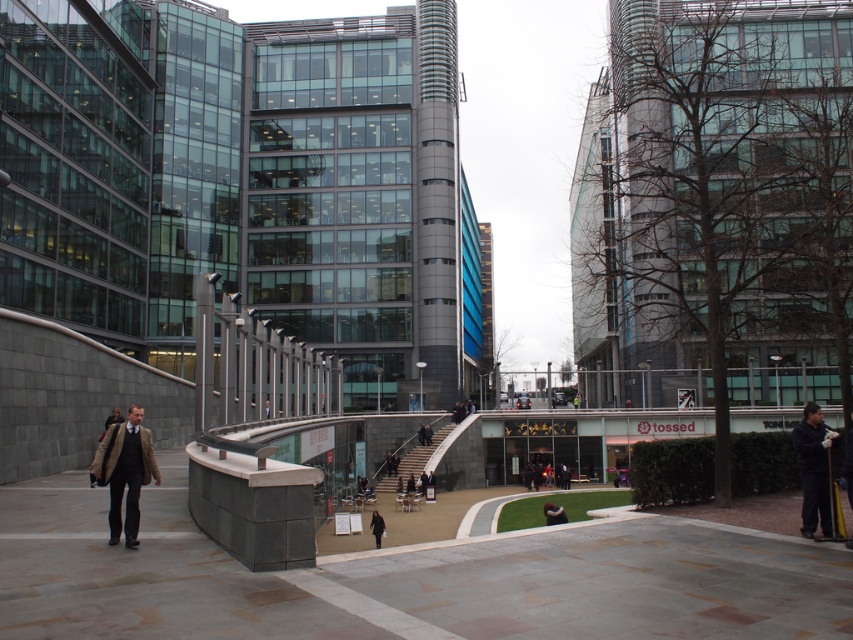
Who is higher up, brown wool coat at center or dark gray jacket at lower right?

brown wool coat at center is higher up.

Which is in front, point (149, 445) or point (828, 508)?

Point (149, 445) is more forward.

Does point (126, 422) come in front of point (816, 420)?

Yes, point (126, 422) is closer to viewer.

You are a GUI agent. You are given a task and a screenshot of the screen. Output one action in this format:
    pyautogui.click(x=<x>, y=<y>)
    Task: Click on the brown wool coat at center
    
    Given the screenshot: What is the action you would take?
    pyautogui.click(x=125, y=472)

Can you confirm if dark gray jacket at lower right is positioned below light brown leather jacket at lower left?

Yes.

Describe the element at coordinates (813, 468) in the screenshot. The width and height of the screenshot is (853, 640). I see `dark gray jacket at lower right` at that location.

Find the location of `dark gray jacket at lower right`. dark gray jacket at lower right is located at coordinates (813, 468).

Does brown wool coat at center have a greater width compared to dark gray coat at center?

No.

Describe the element at coordinates (125, 472) in the screenshot. I see `brown wool coat at center` at that location.

Consider the image. Who is more forward, (132, 420) or (380, 522)?

Positioned in front is point (132, 420).

At what (x,y) coordinates should I click in order to perform the action: click on brown wool coat at center. Please return your answer as a coordinate pair (x, y). This screenshot has height=640, width=853. Looking at the image, I should click on (125, 472).